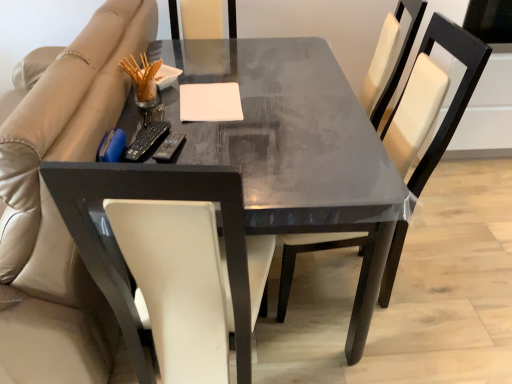
This screenshot has width=512, height=384. Find the location of `free space behind white matte notepad at center`. free space behind white matte notepad at center is located at coordinates (224, 77).